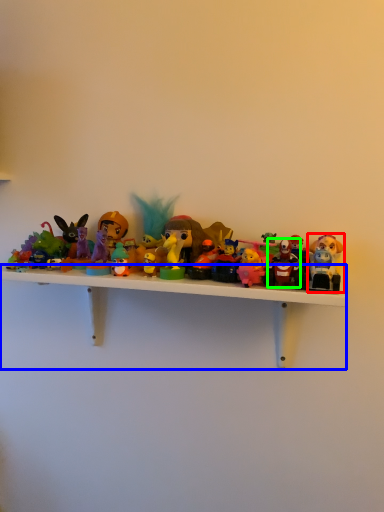
Question: Estimate the real-world distances between objects in this image. Which object is farther from toy (highlighted by a red box), shelf (highlighted by a blue box) or toy (highlighted by a green box)?

Choices:
 (A) shelf
 (B) toy

Answer: (A)